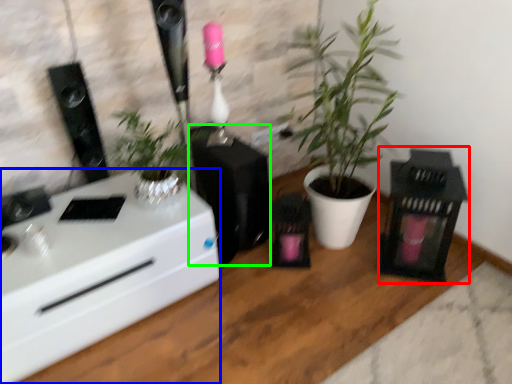
Question: Considering the real-world distances, which object is farthest from appliance (highlighted by a red box)? desk (highlighted by a blue box) or appliance (highlighted by a green box)?

Choices:
 (A) desk
 (B) appliance

Answer: (A)